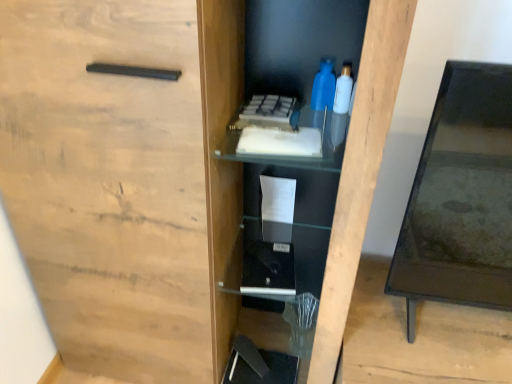
Where is `free point below black glass table at right (from a real-world perspective)`? free point below black glass table at right (from a real-world perspective) is located at coordinates (449, 331).